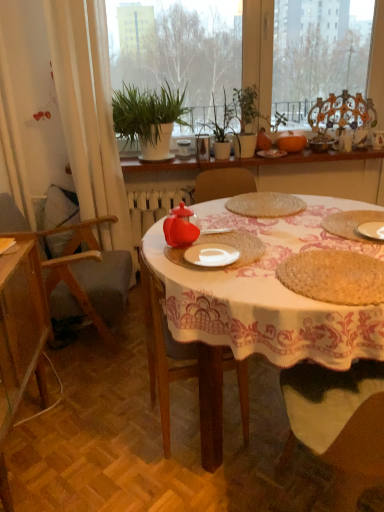
I want to click on free space to the back side of matte glass teapot at center, so click(211, 227).